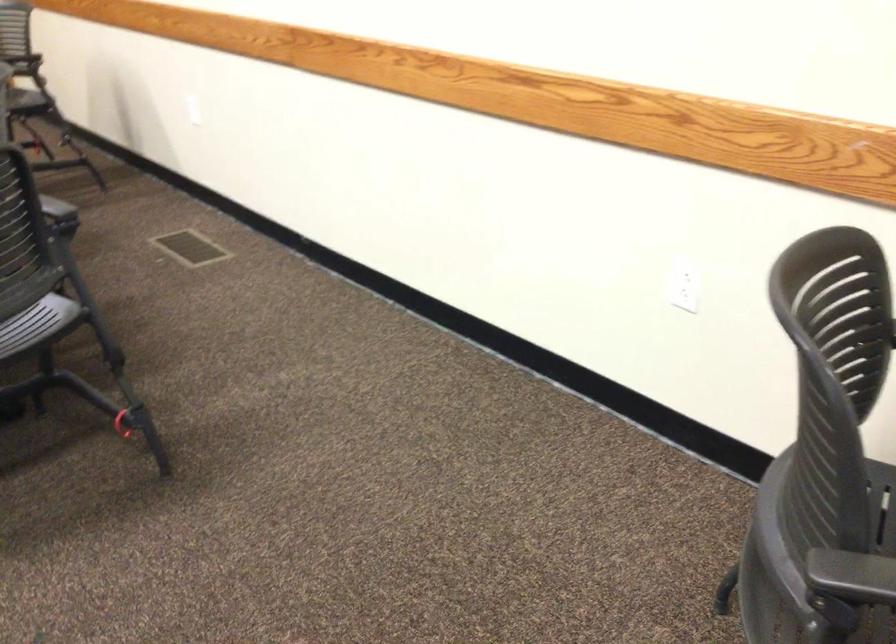
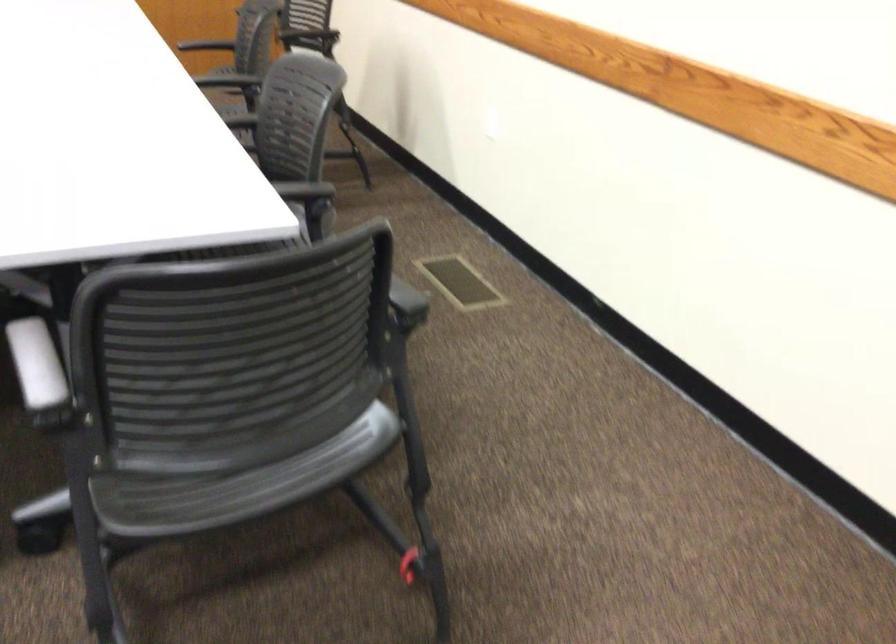
Which direction would the cameraman need to move to produce the second image?

The movement direction of the cameraman is left, forward.